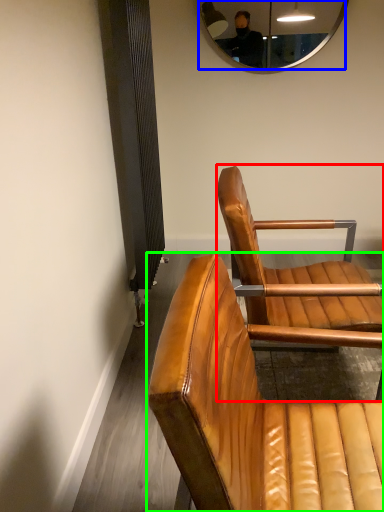
Question: Estimate the real-world distances between objects in this image. Which object is farther from chair (highlighted by a red box), mirror (highlighted by a blue box) or chair (highlighted by a green box)?

Choices:
 (A) mirror
 (B) chair

Answer: (A)